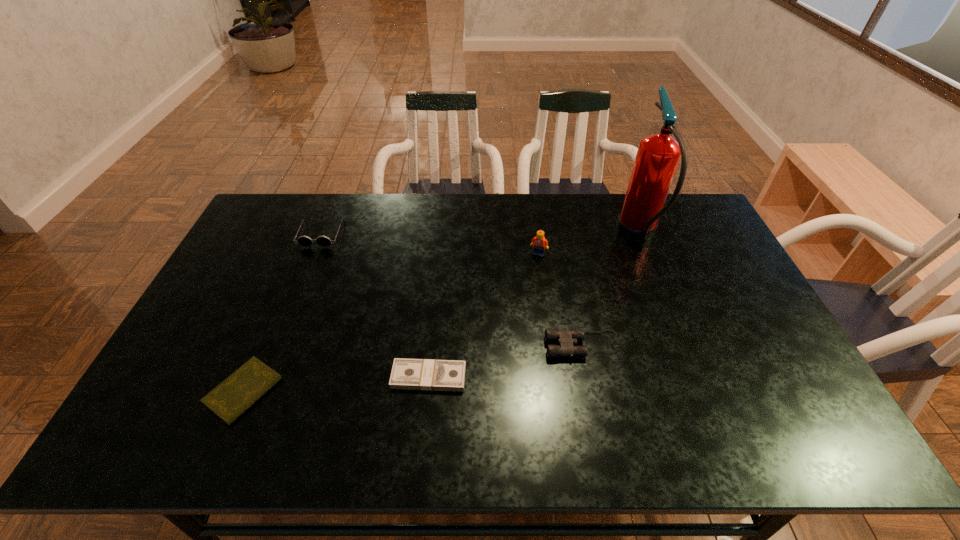
You are a GUI agent. You are given a task and a screenshot of the screen. Output one action in this format:
    pyautogui.click(x=<x>, y=<y>)
    Task: Click on the free region at the far edge of the desktop
    Image resolution: width=960 pixels, height=540 pixels.
    Given the screenshot: What is the action you would take?
    pyautogui.click(x=556, y=212)

Identify the location of vacant space at the near edge of the desktop. This screenshot has height=540, width=960. (380, 447).

In order to click on vacant region at the left edge in this screenshot , I will do `click(278, 249)`.

Locate an element on the screen. This screenshot has height=540, width=960. vacant space at the right edge of the desktop is located at coordinates (727, 326).

What are the coordinates of `free region at the far left corner of the desktop` in the screenshot? It's located at (276, 196).

This screenshot has width=960, height=540. In order to click on vacant point located between the third tallest object and the third shortest object in this screenshot , I will do `click(452, 290)`.

Find the location of a particular element. Image resolution: width=960 pixels, height=540 pixels. vacant area that lies between the binoculars and the third object from left to right is located at coordinates (506, 361).

Find the location of a particular element. vacant area that lies between the dollar and the fire extinguisher is located at coordinates (534, 307).

Locate an element on the screen. free space that is in between the fire extinguisher and the diary is located at coordinates (441, 314).

At what (x,y) coordinates should I click in order to perform the action: click on vacant area that lies between the Lego and the tallest object. Please return your answer as a coordinate pair (x, y). Image resolution: width=960 pixels, height=540 pixels. Looking at the image, I should click on (588, 245).